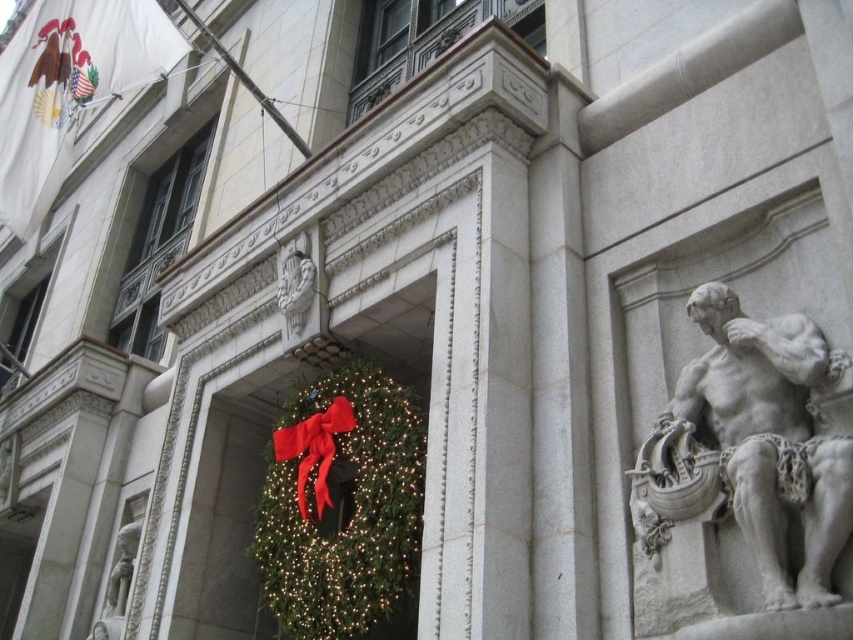
Question: Does white stone statue at right appear over green textured wreath at center?

Choices:
 (A) no
 (B) yes

Answer: (B)

Question: Considering the relative positions of white stone statue at right and green textured wreath at center in the image provided, where is white stone statue at right located with respect to green textured wreath at center?

Choices:
 (A) above
 (B) below

Answer: (A)

Question: Which point appears farthest from the camera in this image?

Choices:
 (A) (374, 461)
 (B) (665, 529)

Answer: (A)

Question: Which point is farther to the camera?

Choices:
 (A) (820, 596)
 (B) (347, 502)

Answer: (B)

Question: Can you confirm if white stone statue at right is positioned to the right of green textured wreath at center?

Choices:
 (A) yes
 (B) no

Answer: (A)

Question: Which point is farther from the camera taking this photo?

Choices:
 (A) (786, 424)
 (B) (376, 604)

Answer: (B)